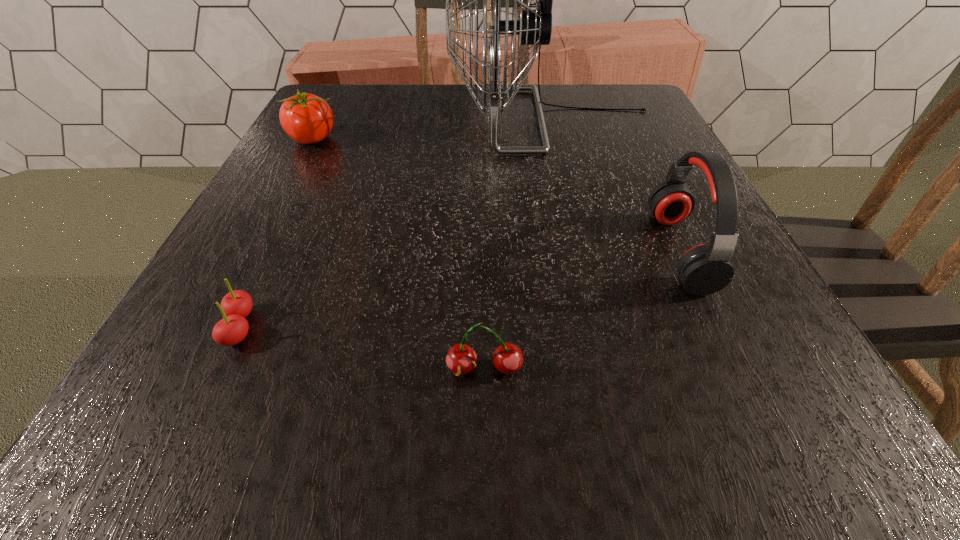
Locate an element on the screen. The image size is (960, 540). vacant area between the nearest object and the fan is located at coordinates click(x=518, y=244).

Locate an element on the screen. The width and height of the screenshot is (960, 540). free space between the tomato and the fourth shortest object is located at coordinates (496, 195).

I want to click on empty space between the shortest object and the nearer cherry, so click(362, 348).

This screenshot has height=540, width=960. I want to click on vacant space that is in between the shortest object and the nearer cherry, so click(362, 348).

Identify the location of free spot between the second tallest object and the tallest object. (615, 185).

At what (x,y) coordinates should I click in order to perform the action: click on unoccupied area between the tomato and the fan. Please return your answer as a coordinate pair (x, y). This screenshot has width=960, height=540. Looking at the image, I should click on (432, 130).

This screenshot has height=540, width=960. I want to click on free spot between the nearest object and the tomato, so click(x=398, y=254).

The width and height of the screenshot is (960, 540). In order to click on unoccupied area between the tomato and the tallest object in this screenshot , I will do `click(432, 130)`.

At what (x,y) coordinates should I click in order to perform the action: click on vacant space in between the third farthest object and the shortest object. Please return your answer as a coordinate pair (x, y). This screenshot has width=960, height=540. Looking at the image, I should click on (460, 289).

Locate an element on the screen. This screenshot has width=960, height=540. vacant space in between the second nearest object and the nearer cherry is located at coordinates (362, 348).